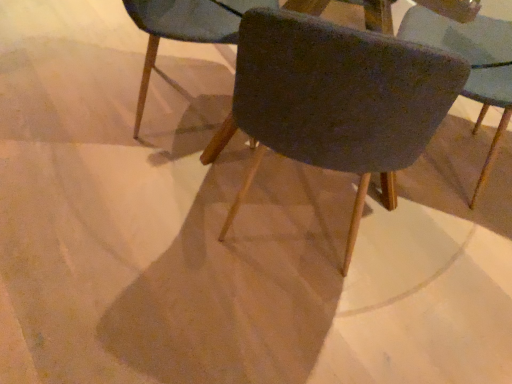
Find the location of a particular element. vacant space in front of velvet dark blue chair at center, which is the 1th chair from right to left is located at coordinates (440, 252).